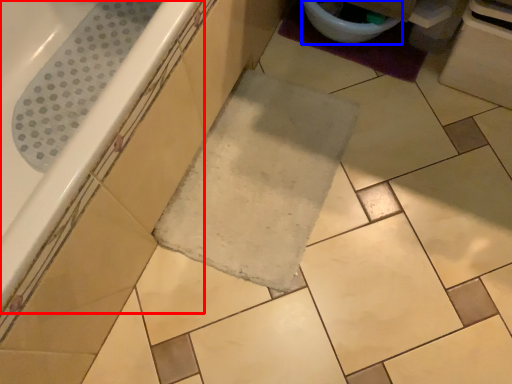
Question: Which object appears farthest to the camera in this image, bathtub (highlighted by a red box) or toilet bowl (highlighted by a blue box)?

Choices:
 (A) bathtub
 (B) toilet bowl

Answer: (B)